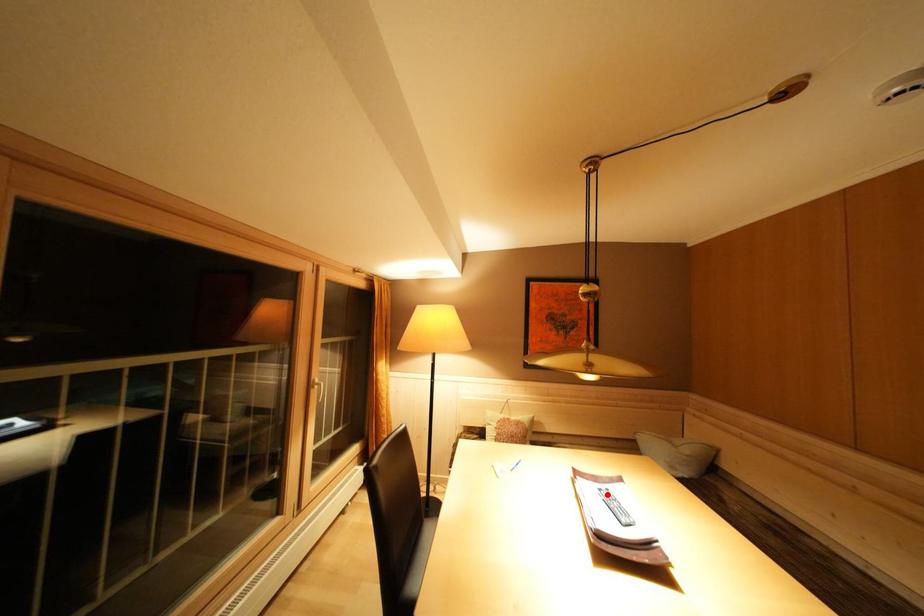
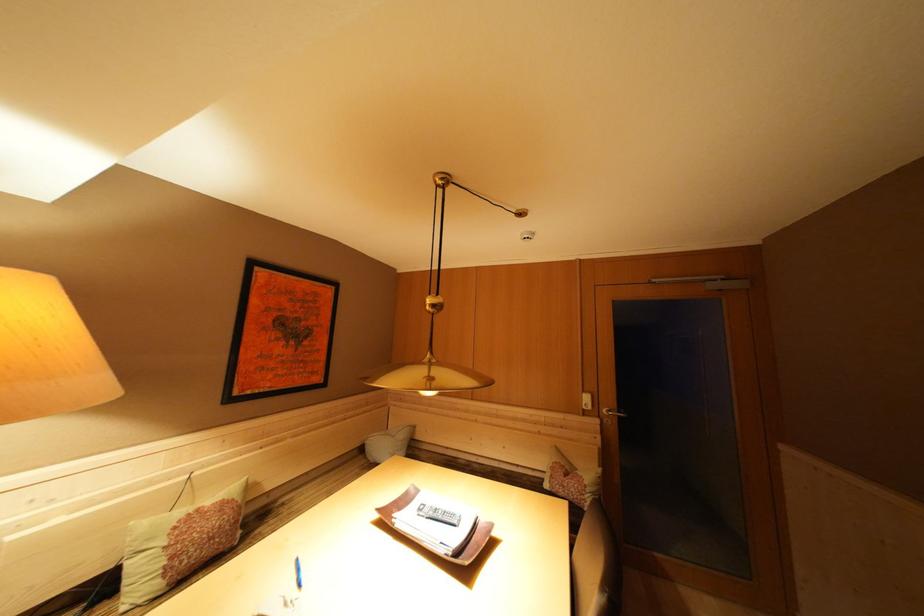
In the second image, find the point that corresponds to the highlighted location in the first image.

(427, 515)